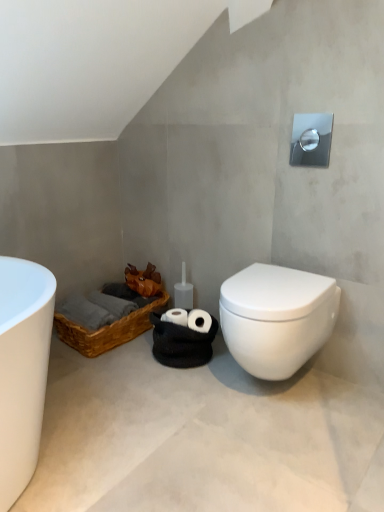
You are a GUI agent. You are given a task and a screenshot of the screen. Output one action in this format:
    pyautogui.click(x=<x>, y=<y>)
    Task: Click on the vacant area on top of white glossy toilet at lower right (from a real-world perspective)
    The width and height of the screenshot is (384, 512).
    Given the screenshot: What is the action you would take?
    pyautogui.click(x=277, y=284)